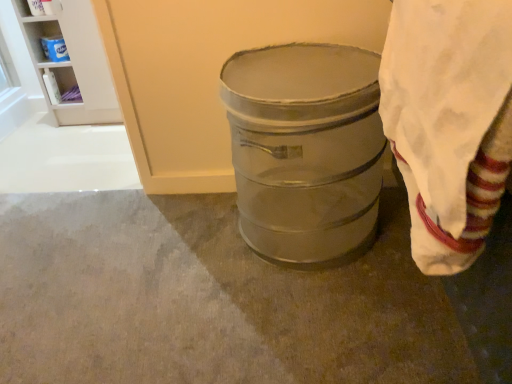
Question: Is metallic gray trash can at center taller or shorter than white plastic shelf at upper left, marked as the second shelf in a left-to-right arrangement?

Choices:
 (A) short
 (B) tall

Answer: (A)

Question: Considering the positions of metallic gray trash can at center and white plastic shelf at upper left, marked as the second shelf in a left-to-right arrangement, in the image, is metallic gray trash can at center bigger or smaller than white plastic shelf at upper left, marked as the second shelf in a left-to-right arrangement,?

Choices:
 (A) small
 (B) big

Answer: (B)

Question: Which is nearer to the white glossy shelf at upper left, which is counted as the first shelf, starting from the left?

Choices:
 (A) white plastic shelf at upper left, marked as the second shelf in a left-to-right arrangement
 (B) white cotton cloth at right
 (C) metallic gray trash can at center
 (D) metallic gray barrel at center

Answer: (A)

Question: Based on their relative distances, which object is nearer to the white glossy shelf at upper left, which is counted as the first shelf, starting from the left?

Choices:
 (A) metallic gray trash can at center
 (B) white plastic shelf at upper left, marked as the second shelf in a left-to-right arrangement
 (C) white cotton cloth at right
 (D) metallic gray barrel at center

Answer: (B)